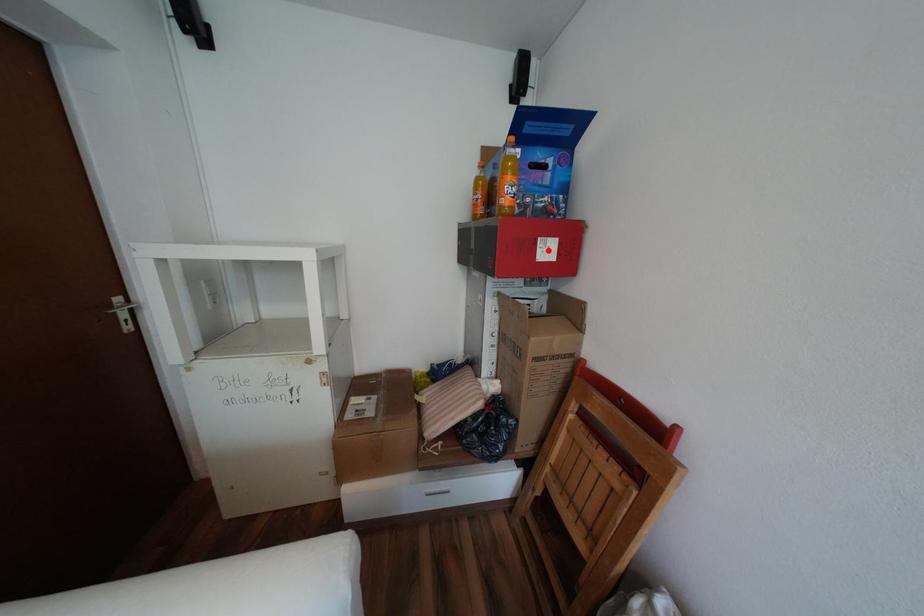
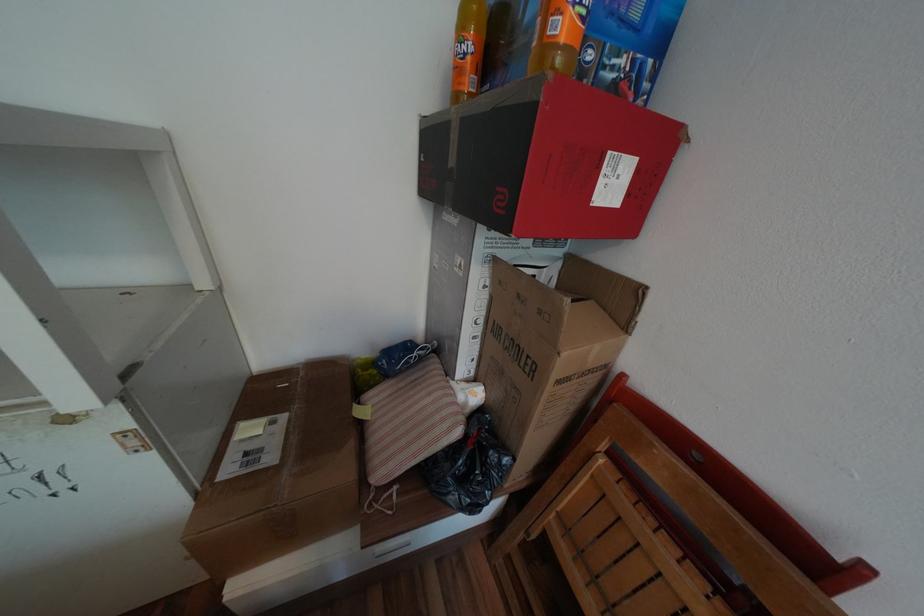
Find the pixel in the second image that matches the highlighted location in the first image.

(611, 182)